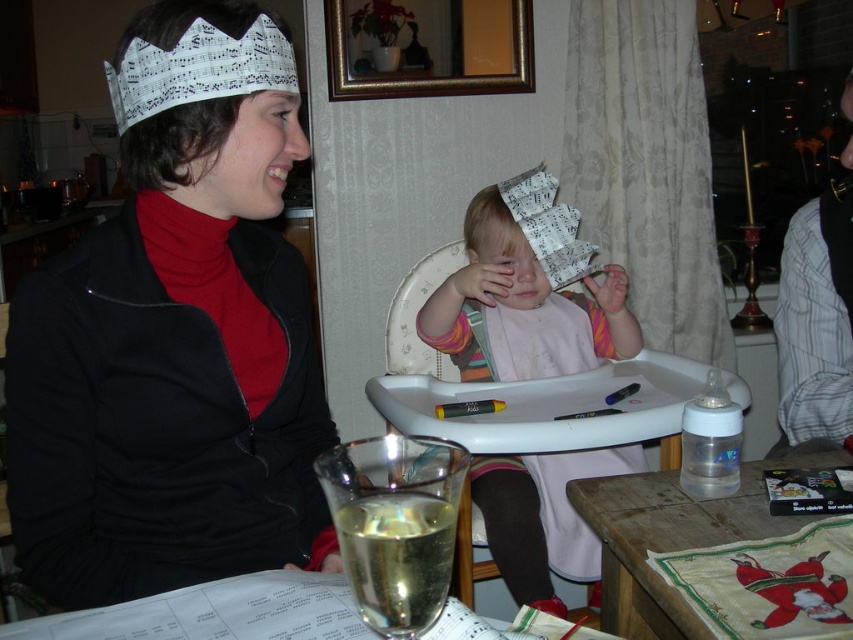
You are planning to place a decorative item on the table. Given the spatial relationship between the white paper crown at center and the wooden table at lower right, will the crown fit on the table without exceeding its height?

The white paper crown at center is taller than the wooden table at lower right. Since the crown is taller than the table, placing it on the table would cause it to exceed the table height, so it might not fit properly or could tip over.

In the scene shown: You are planning to place a large rectangular cake on the wooden table at center and the wooden table at lower right. Based on the scene description, which table would be more suitable for placing the cake?

The wooden table at center is more suitable for placing the large rectangular cake because its width is larger than the wooden table at lower right.